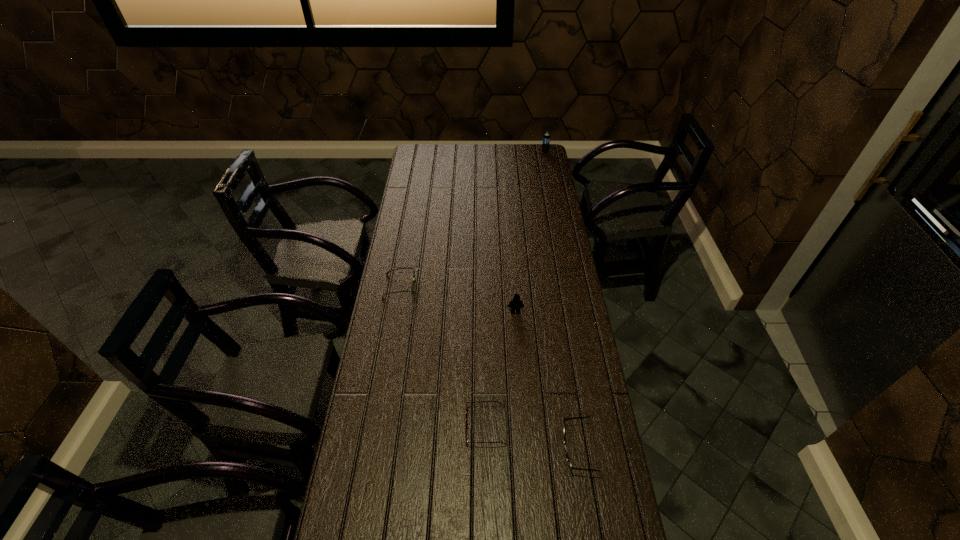
Where is `vacant region between the Lego and the fourth object from right to left`? vacant region between the Lego and the fourth object from right to left is located at coordinates (500, 369).

What are the coordinates of `vacant region between the farthest object and the fourth object from left to right` in the screenshot? It's located at (x=561, y=301).

This screenshot has width=960, height=540. Find the location of `vacant point located between the fourth object from left to right and the tallest object`. vacant point located between the fourth object from left to right and the tallest object is located at coordinates (561, 301).

The width and height of the screenshot is (960, 540). Find the location of `vacant area that lies between the second tallest spectacles and the soda bottle`. vacant area that lies between the second tallest spectacles and the soda bottle is located at coordinates (472, 219).

Identify the location of vacant space that is in between the second shortest spectacles and the second object from right to left. (489, 368).

Identify the location of empty location between the fourth shortest object and the rightmost spectacles. (546, 381).

Locate an element on the screen. This screenshot has width=960, height=540. empty location between the second tallest object and the fourth tallest object is located at coordinates (458, 299).

Locate an element on the screen. Image resolution: width=960 pixels, height=540 pixels. blank region between the fourth object from left to right and the third farthest object is located at coordinates (546, 381).

This screenshot has height=540, width=960. What are the coordinates of `object that is the closest to the leftmost object` in the screenshot? It's located at (516, 303).

Select which object is the second closest to the rightmost object. Please provide its 2D coordinates. Your answer should be formatted as a tuple, i.e. [(x, y)], where the tuple contains the x and y coordinates of a point satisfying the conditions above.

[(516, 303)]